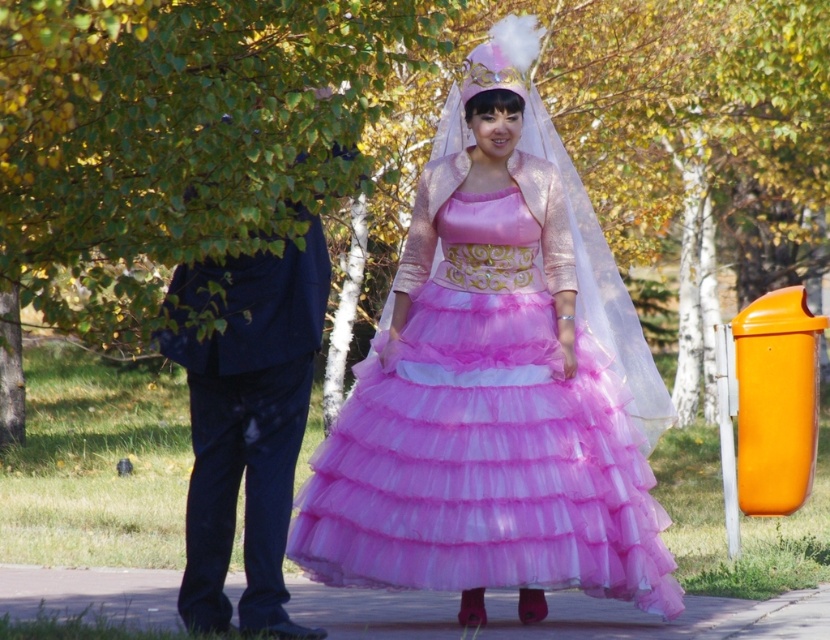
Is point (511, 109) closer to camera compared to point (238, 353)?

No, it is not.

Which is above, matte pink tulle dress at center or dark blue suit at left?

Positioned higher is matte pink tulle dress at center.

Describe the element at coordinates (496, 387) in the screenshot. This screenshot has width=830, height=640. I see `matte pink tulle dress at center` at that location.

This screenshot has width=830, height=640. Find the location of `matte pink tulle dress at center`. matte pink tulle dress at center is located at coordinates (496, 387).